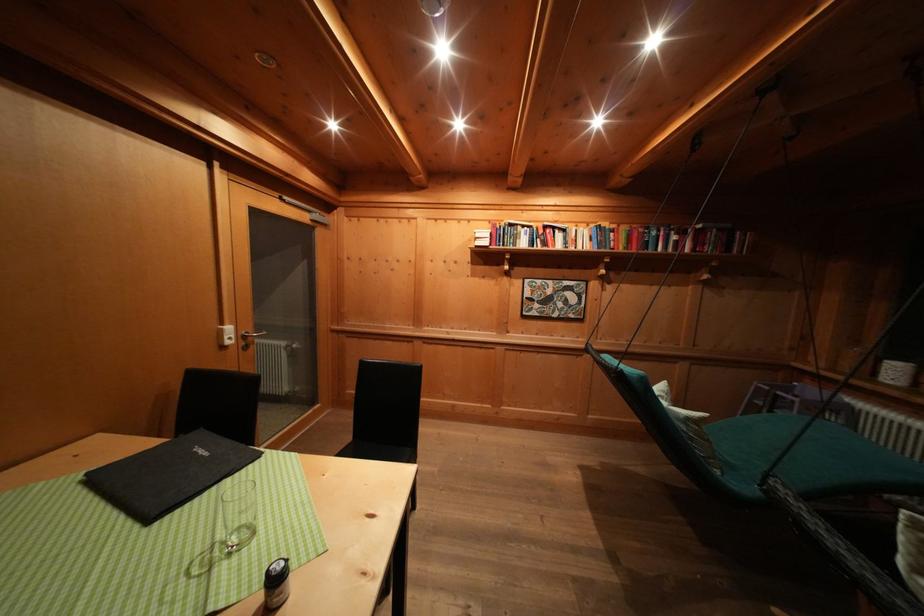
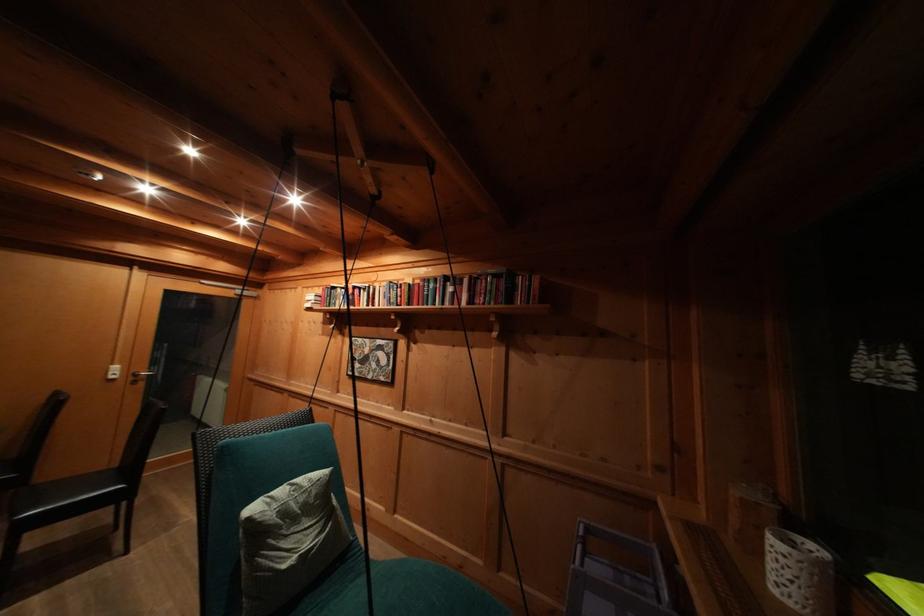
Locate, in the second image, the point that corresponds to [250,342] in the first image.

(141, 379)